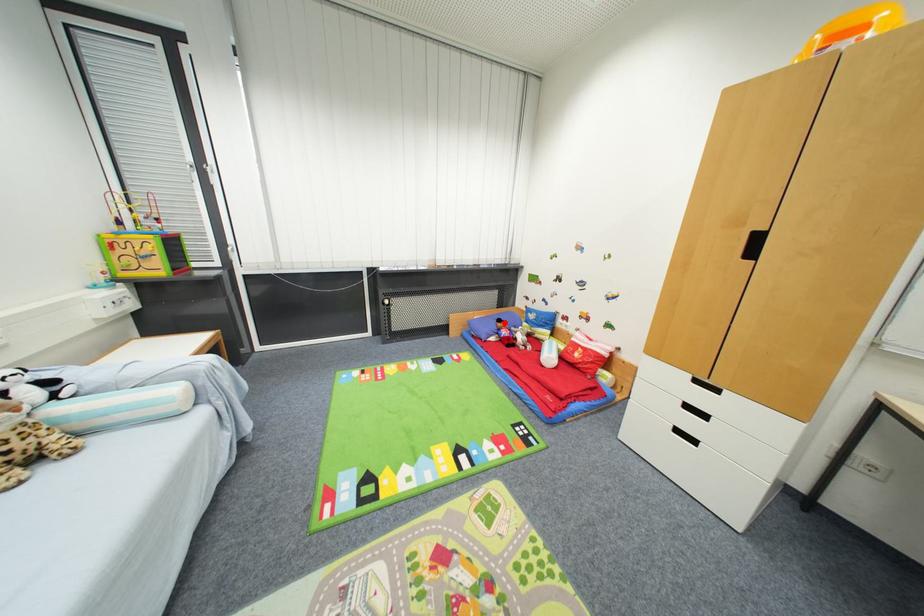
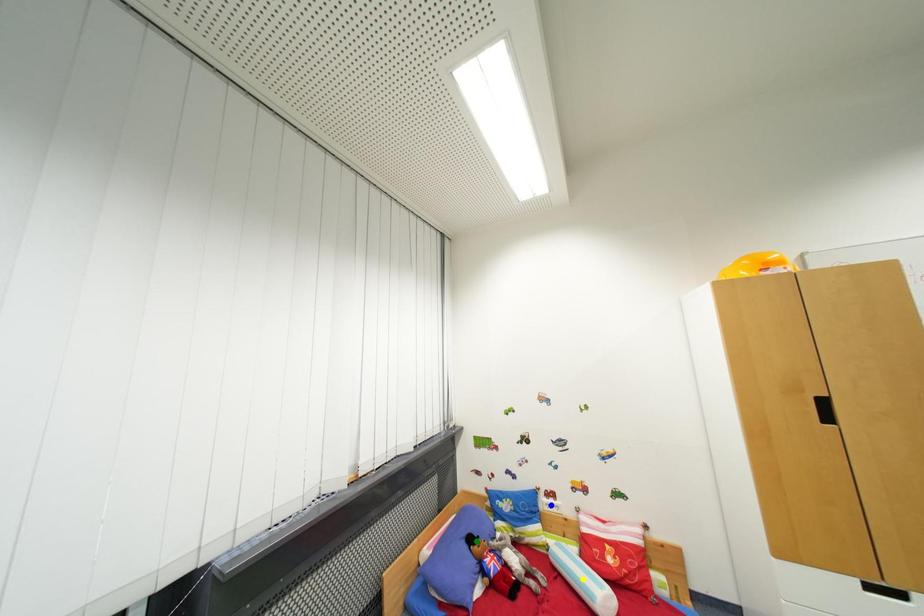
Question: I am providing you with two images of the same scene from different viewpoints. A red point is marked on the first image. You are given multiple points on the second image. Which point in image 2 is actually the same real-world point as the red point in image 1?

Choices:
 (A) yellow point
 (B) blue point
 (C) green point

Answer: (C)